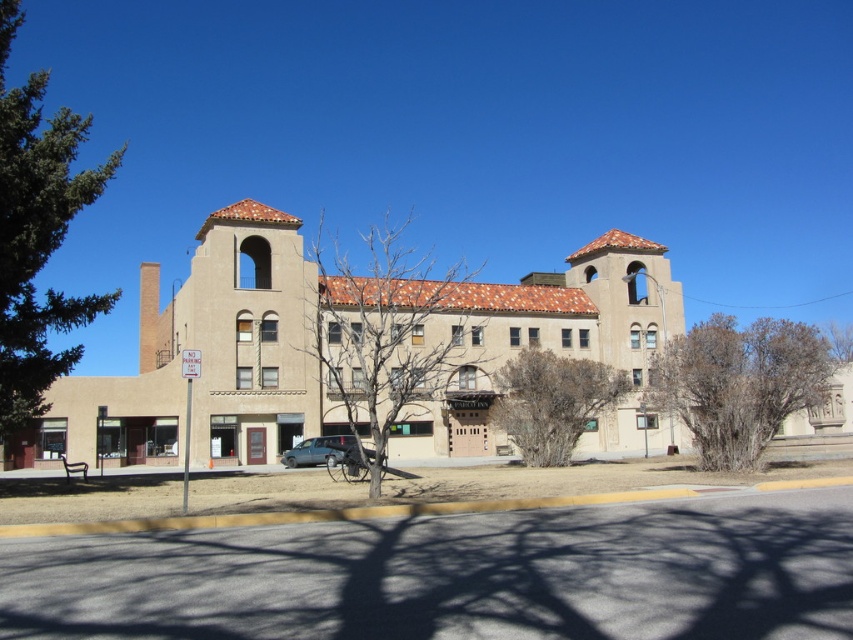
Question: Which point appears farthest from the camera in this image?

Choices:
 (A) (318, 440)
 (B) (743, 456)
 (C) (419, 333)

Answer: (C)

Question: Which is nearer to the brown textured tree at center?

Choices:
 (A) bare branches at center
 (B) brown leafless bush at right
 (C) green leafy tree at left

Answer: (B)

Question: Is green leafy tree at left to the left of brown leafless bush at right from the viewer's perspective?

Choices:
 (A) yes
 (B) no

Answer: (A)

Question: Can you confirm if green leafy tree at left is smaller than brown leafless bush at right?

Choices:
 (A) no
 (B) yes

Answer: (A)

Question: Does green leafy tree at left lie in front of metallic silver car at center?

Choices:
 (A) yes
 (B) no

Answer: (A)

Question: Which object is positioned farthest from the metallic silver car at center?

Choices:
 (A) beige stucco church at center
 (B) bare branches at center

Answer: (B)